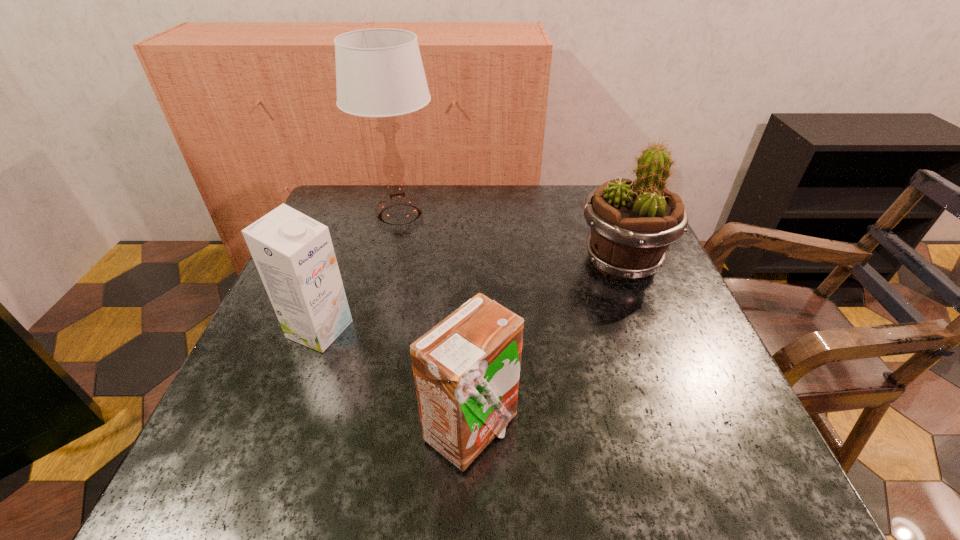
This screenshot has width=960, height=540. I want to click on table lamp, so click(379, 72).

Locate an element on the screen. Image resolution: width=960 pixels, height=540 pixels. flowerpot is located at coordinates (633, 223).

The image size is (960, 540). In order to click on the farther carton in this screenshot , I will do `click(294, 255)`.

Locate an element on the screen. the second nearest object is located at coordinates pyautogui.click(x=294, y=255).

I want to click on the second object from right to left, so click(x=466, y=369).

The width and height of the screenshot is (960, 540). Identify the location of the nearer carton. (466, 369).

Where is `vacant space located 0.380m on the front-facing side of the table lamp`? This screenshot has width=960, height=540. vacant space located 0.380m on the front-facing side of the table lamp is located at coordinates (364, 359).

You are a GUI agent. You are given a task and a screenshot of the screen. Output one action in this format:
    pyautogui.click(x=<x>, y=<y>)
    Task: Click on the vacant point located on the left of the rightmost object
    This screenshot has width=960, height=540.
    Given the screenshot: What is the action you would take?
    pyautogui.click(x=516, y=262)

Where is `vacant space located 0.310m on the back of the left carton`? This screenshot has width=960, height=540. vacant space located 0.310m on the back of the left carton is located at coordinates (359, 223).

The height and width of the screenshot is (540, 960). Identify the location of free point located on the straw side of the nearest object. (662, 430).